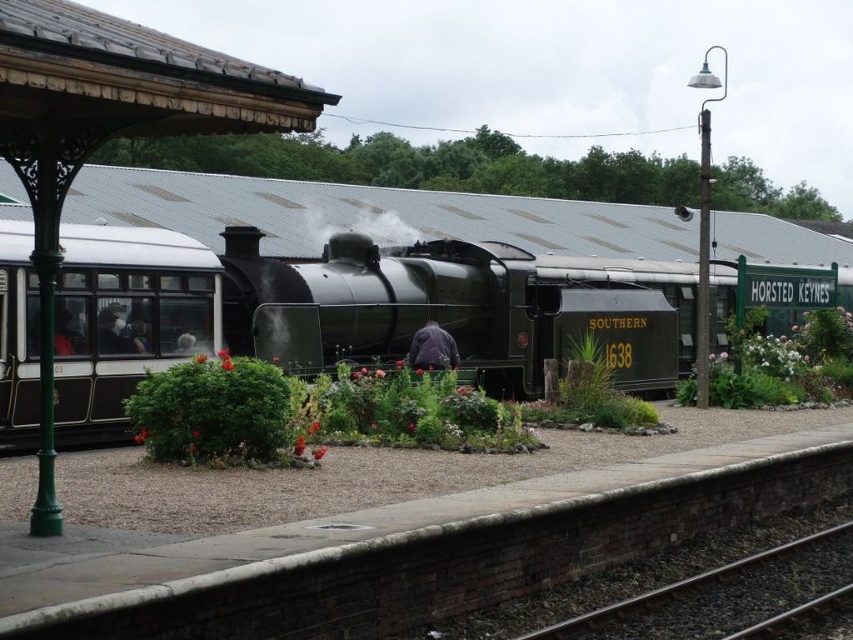
You are standing at the railway station and want to reach the point marked as point (x=207, y=307). The path is clear, but there is a safety rule stating that you must stay at least 10 feet away from the edge of the platform. If the platform edge is 50 feet away from your current position, can you safely reach the point without violating the safety rule?

The distance between you and point (x=207, y=307) is 56.64 feet. Since the platform edge is 50 feet away from your current position, reaching the point would require moving 6.64 feet beyond the edge, which violates the safety rule. Therefore, you cannot safely reach the point without breaking the rule.

You are standing on the platform at the railway station looking towards the steam locomotive. There are two points marked on the platform. Which point is closer to you, point (527, 349) or point (166, 333)?

Point (527, 349) is further to the viewer than point (166, 333), so the closer point to you is point (166, 333).

You are a photographer wanting to capture both the shiny black steam locomotive at center and the matte black passenger car at left in a single frame. Which object should you position closer to the camera to ensure both are fully visible without cropping?

The shiny black steam locomotive at center is not as tall as the matte black passenger car at left, so you should position the shiny black steam locomotive at center closer to the camera to ensure both are fully visible without cropping.